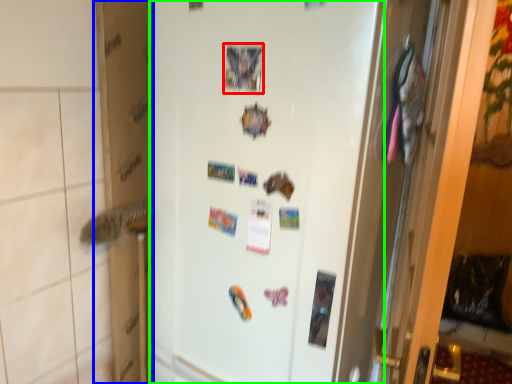
Question: Based on their relative distances, which object is farther from postcard (highlighted by a red box)? Choose from cardboard box (highlighted by a blue box) and refrigerator (highlighted by a green box).

Choices:
 (A) cardboard box
 (B) refrigerator

Answer: (A)